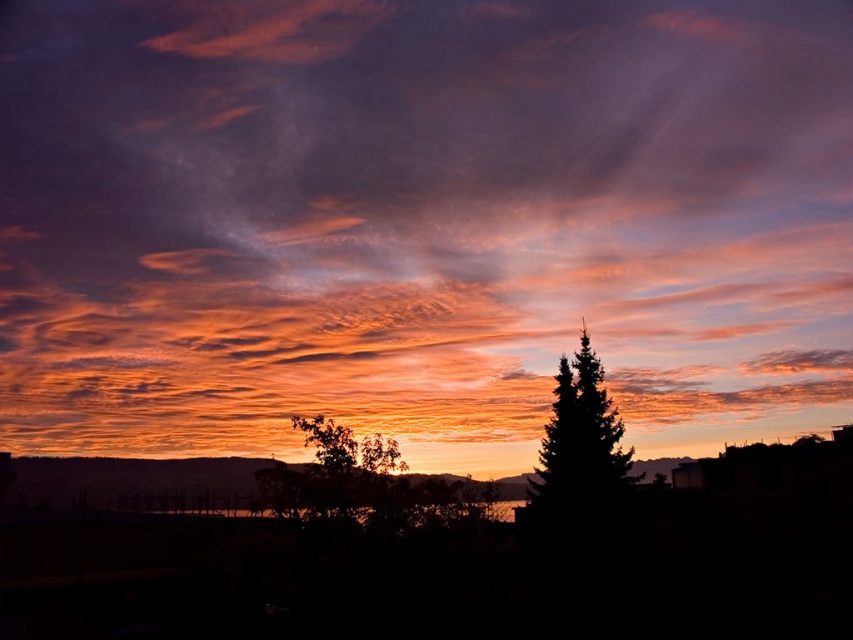
Can you confirm if silhouette fir tree at right is shorter than green leafy tree at center?

No, silhouette fir tree at right is not shorter than green leafy tree at center.

Find the location of `silhouette fir tree at right`. silhouette fir tree at right is located at coordinates (579, 445).

Is point (581, 404) farther from viewer compared to point (358, 496)?

Yes, it is.

Find the location of a particular element. silhouette fir tree at right is located at coordinates tap(579, 445).

Between orange translucent cloud at center and silhouette fir tree at right, which one is positioned lower?

Answer: Positioned lower is silhouette fir tree at right.

Is orange translucent cloud at center bigger than silhouette fir tree at right?

Correct, orange translucent cloud at center is larger in size than silhouette fir tree at right.

Which is in front, point (251, 3) or point (605, 403)?

Point (605, 403) is in front.

Locate an element on the screen. orange translucent cloud at center is located at coordinates (421, 221).

Between point (505, 42) and point (343, 456), which one is positioned in front?

Point (343, 456) is more forward.

Consider the image. Does orange translucent cloud at center have a greater width compared to green leafy tree at center?

Correct, the width of orange translucent cloud at center exceeds that of green leafy tree at center.

Identify the location of orange translucent cloud at center. The image size is (853, 640). (421, 221).

I want to click on orange translucent cloud at center, so click(421, 221).